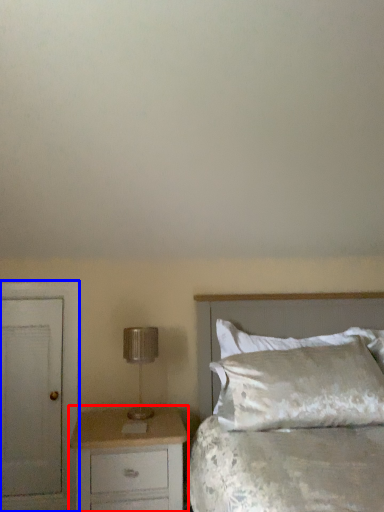
Question: Which object is closer to the camera taking this photo, chest of drawers (highlighted by a red box) or armoire (highlighted by a blue box)?

Choices:
 (A) chest of drawers
 (B) armoire

Answer: (A)